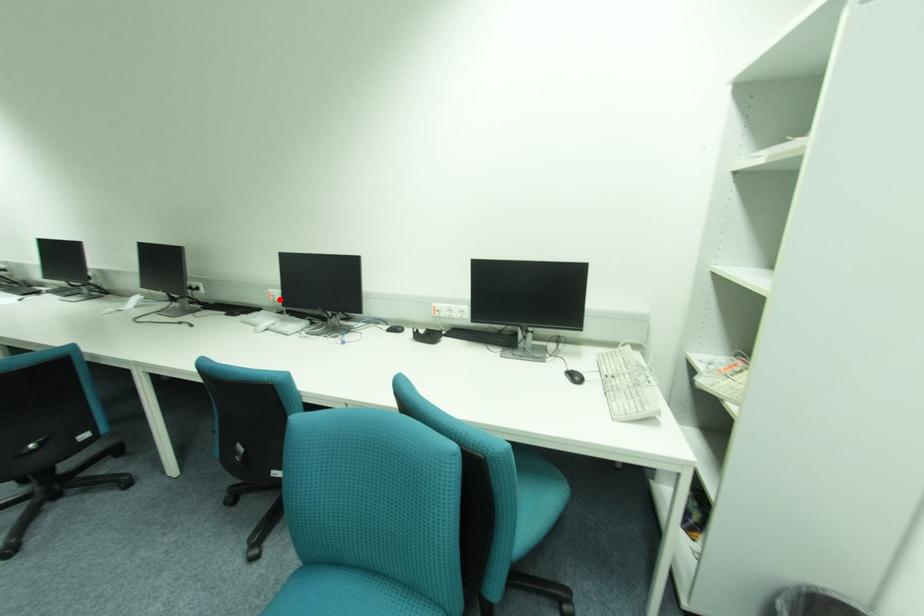
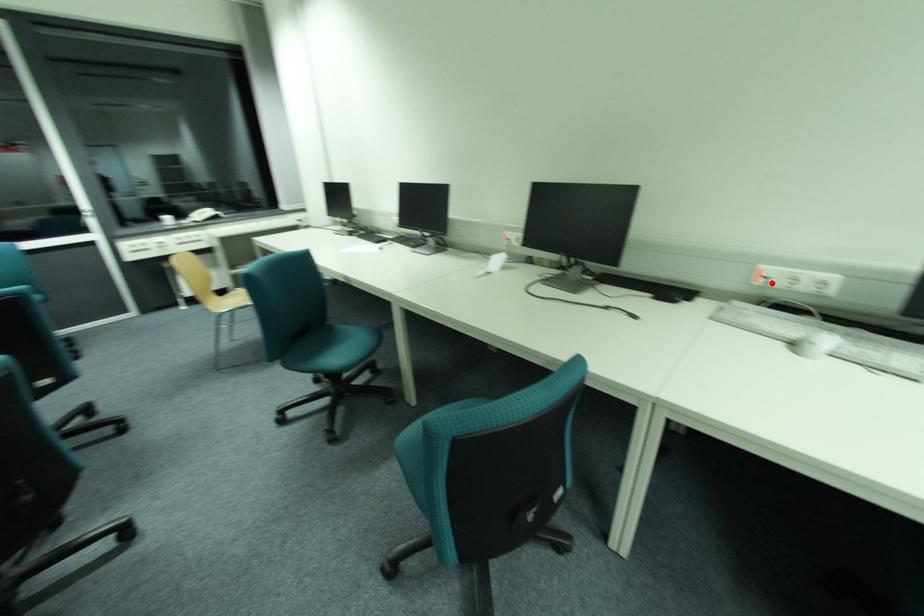
I am providing you with two images of the same scene from different viewpoints. A red point is marked on the first image and another point is marked on the second image. Do the highlighted points in image1 and image2 indicate the same real-world spot?

Yes